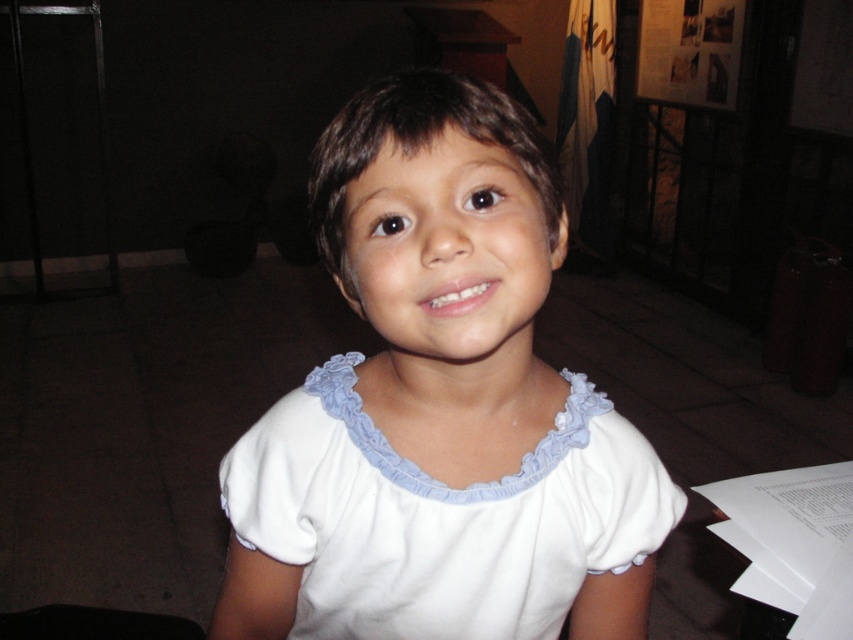
Question: Can you confirm if white cotton shirt at center is positioned to the left of white cotton dress at center?

Choices:
 (A) yes
 (B) no

Answer: (A)

Question: Which object is closer to the camera taking this photo?

Choices:
 (A) white cotton shirt at center
 (B) white cotton dress at center

Answer: (A)

Question: Which point is farther to the camera?

Choices:
 (A) white cotton shirt at center
 (B) white cotton dress at center

Answer: (B)

Question: Can you confirm if white cotton shirt at center is bigger than white cotton dress at center?

Choices:
 (A) yes
 (B) no

Answer: (A)

Question: Which of the following is the farthest from the observer?

Choices:
 (A) white cotton shirt at center
 (B) white cotton dress at center

Answer: (B)

Question: Can you confirm if white cotton shirt at center is positioned to the left of white cotton dress at center?

Choices:
 (A) yes
 (B) no

Answer: (A)